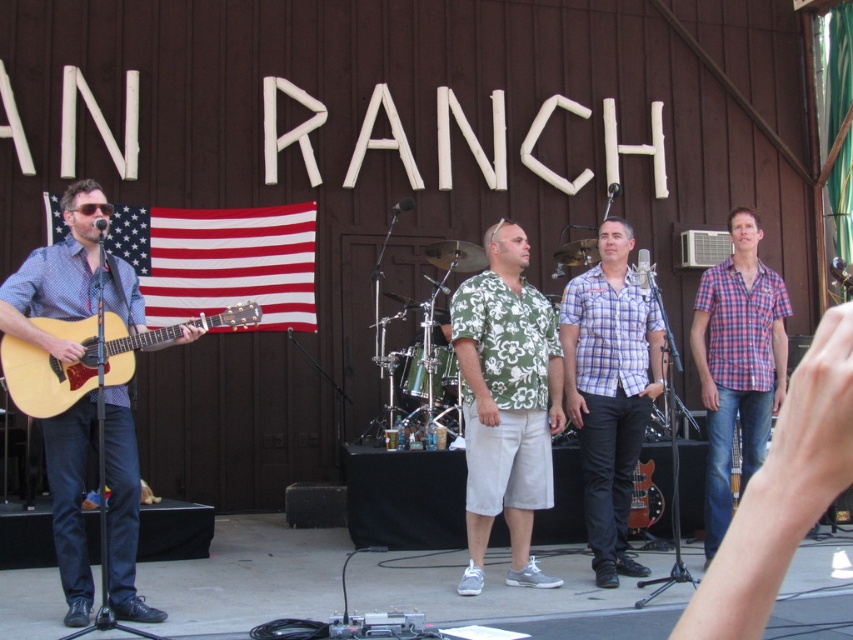
Question: Is plaid cotton shirt at center positioned behind natural wood acoustic guitar at left?

Choices:
 (A) no
 (B) yes

Answer: (B)

Question: Which object appears farthest from the camera in this image?

Choices:
 (A) brushed wood guitar at left
 (B) plaid cotton shirt at center
 (C) green floral shirt at center
 (D) red fabric american flag at left

Answer: (D)

Question: Is brushed wood guitar at left to the left of red fabric american flag at left from the viewer's perspective?

Choices:
 (A) yes
 (B) no

Answer: (B)

Question: Does red fabric american flag at left appear under natural wood acoustic guitar at left?

Choices:
 (A) yes
 (B) no

Answer: (B)

Question: Based on their relative distances, which object is nearer to the red fabric american flag at left?

Choices:
 (A) glossy wood electric guitar at lower center
 (B) green floral shirt at center
 (C) natural wood acoustic guitar at left
 (D) plaid cotton shirt at center

Answer: (B)

Question: Estimate the real-world distances between objects in this image. Which object is closer to the glossy wood electric guitar at lower center?

Choices:
 (A) green floral shirt at center
 (B) natural wood acoustic guitar at left

Answer: (A)